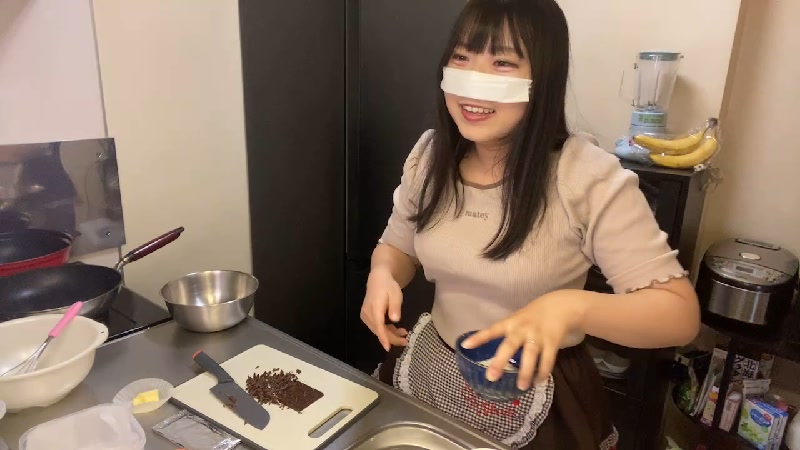
Where is `frying pan`? The width and height of the screenshot is (800, 450). frying pan is located at coordinates (70, 286).